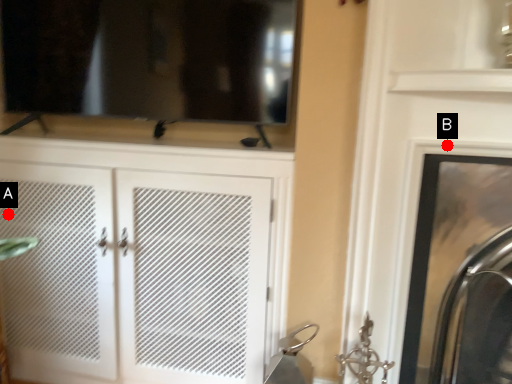
Question: Two points are circled on the image, labeled by A and B beside each circle. Which point appears closest to the camera in this image?

Choices:
 (A) A is closer
 (B) B is closer

Answer: (B)